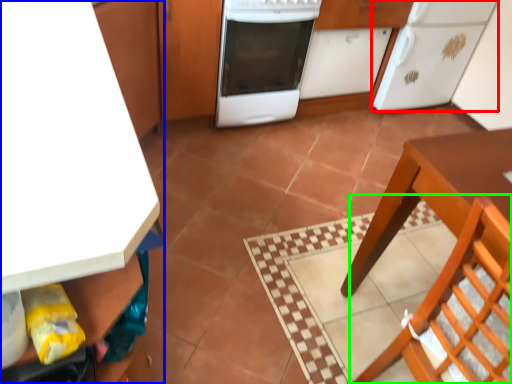
Question: Which object is the farthest from kitchen appliance (highlighted by a red box)? Choose among these: cabinetry (highlighted by a blue box) or chair (highlighted by a green box).

Choices:
 (A) cabinetry
 (B) chair

Answer: (A)